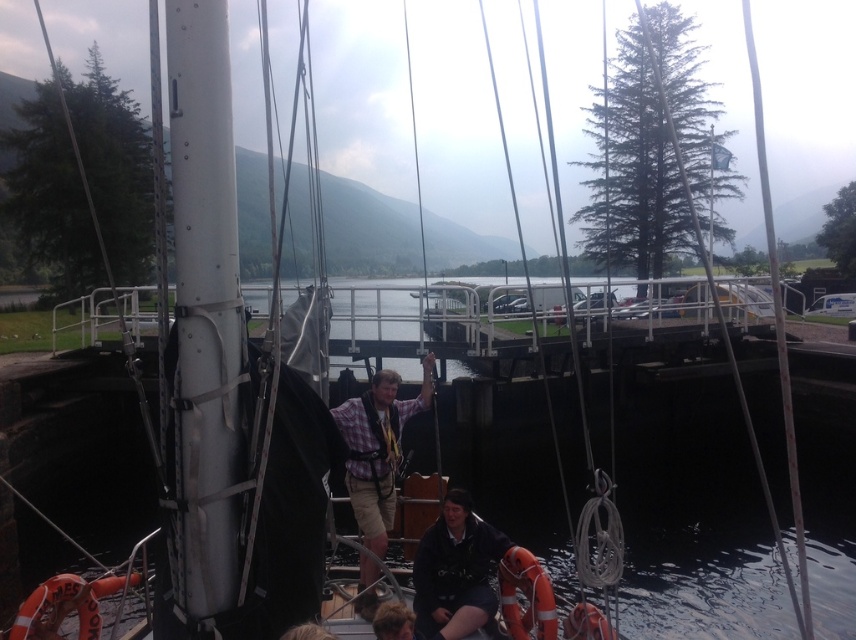
You are on a boat and need to locate the plaid fabric shirt at center and the dark blue fabric at lower center. According to the scene, which object is positioned to the left side?

The plaid fabric shirt at center is to the left of dark blue fabric at lower center.

You are on the boat and looking at the dark blue fabric at lower center and the brown hair at lower center. Which object is positioned lower in the scene?

The dark blue fabric at lower center is positioned lower than the brown hair at lower center.

You are standing on the deck of the boat and need to place a new anchor at the exact location of the dark blue fabric at lower center. What are the coordinates where you should place the anchor?

The coordinates for placing the anchor at the dark blue fabric at lower center are point (x=455, y=572).